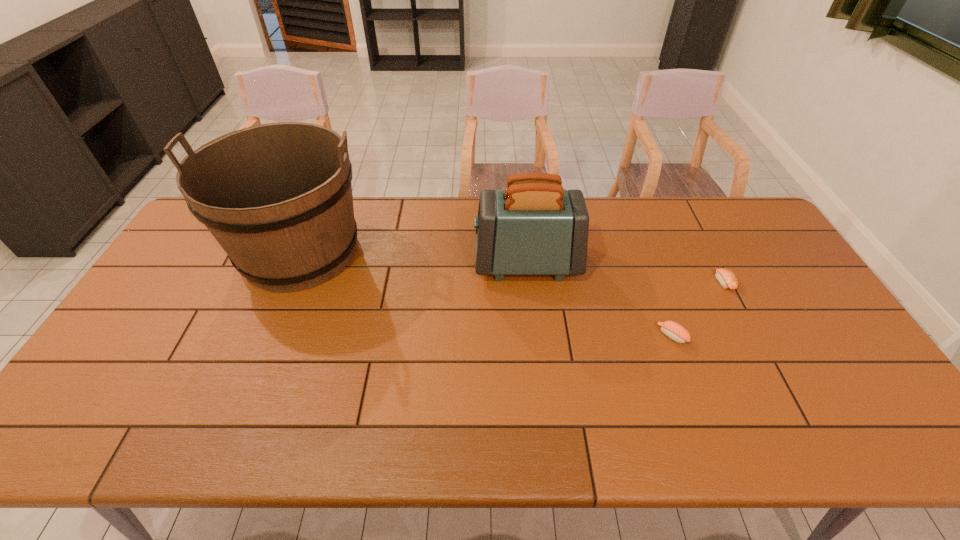
Identify the location of vacant space located 0.390m on the front-facing side of the second tallest object. (349, 263).

The height and width of the screenshot is (540, 960). Identify the location of vacant space situated on the front-facing side of the second tallest object. (404, 263).

Identify the location of free space located on the left of the nearer sushi. The height and width of the screenshot is (540, 960). (551, 336).

The width and height of the screenshot is (960, 540). Identify the location of vacant region located on the front of the rightmost object. (779, 387).

I want to click on object that is positioned at the far edge, so [277, 197].

In order to click on free spot at the far edge of the desktop in this screenshot , I will do `click(434, 227)`.

In the image, there is a desktop. Where is `free region at the near edge`? free region at the near edge is located at coordinates (346, 427).

In the image, there is a desktop. In order to click on free space at the right edge in this screenshot , I will do `click(809, 347)`.

The image size is (960, 540). I want to click on vacant space at the far right corner of the desktop, so click(x=732, y=225).

In the image, there is a desktop. At what (x,y) coordinates should I click in order to perform the action: click on vacant space at the near right corner. Please return your answer as a coordinate pair (x, y). The width and height of the screenshot is (960, 540). Looking at the image, I should click on (855, 413).